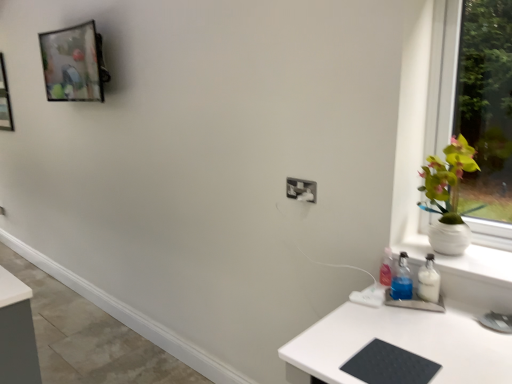
Question: Relative to white plastic electric outlet at center, is metallic glass picture frame at upper left in front or behind?

Choices:
 (A) front
 (B) behind

Answer: (B)

Question: In terms of height, does metallic glass picture frame at upper left look taller or shorter compared to white plastic electric outlet at center?

Choices:
 (A) short
 (B) tall

Answer: (B)

Question: Estimate the real-world distances between objects in this image. Which object is closer to the metallic glass picture frame at upper left?

Choices:
 (A) white ceramic vase at right
 (B) white plastic electric outlet at center
 (C) black rubberized mat at lower right

Answer: (B)

Question: Based on their relative distances, which object is farther from the metallic glass picture frame at upper left?

Choices:
 (A) white plastic electric outlet at center
 (B) white ceramic vase at right
 (C) black rubberized mat at lower right

Answer: (C)